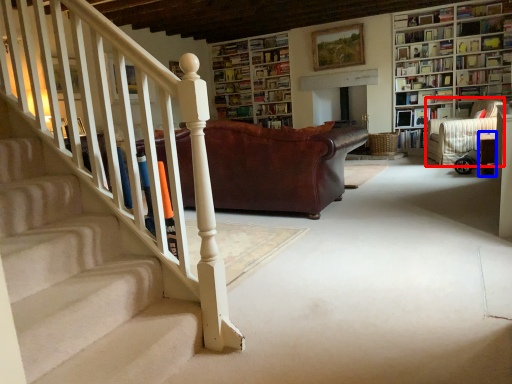
Question: Among these objects, which one is nearest to the camera, armchair (highlighted by a red box) or furniture (highlighted by a blue box)?

Choices:
 (A) armchair
 (B) furniture

Answer: (B)